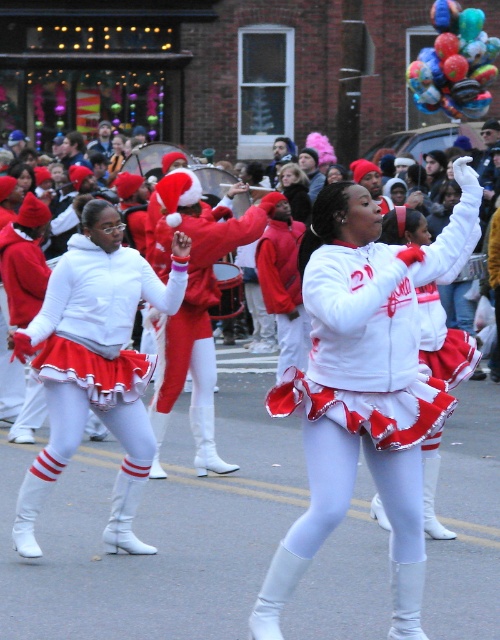
Looking at this image, you are a photographer trying to capture the shiny metallic balloons at upper right and the white matte uniform at center in a single frame. Given that the balloons are larger in the image, which object would appear bigger in your photo?

The shiny metallic balloons at upper right would appear bigger in the photo because they are larger compared to the white matte uniform at center.